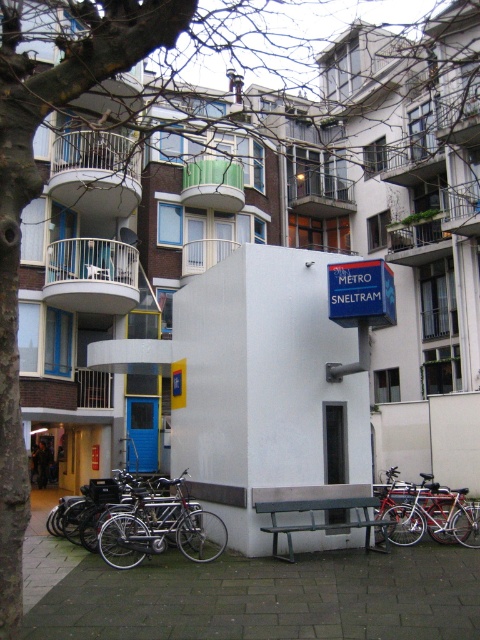
Between silver metallic bicycle at lower center and shiny metallic bicycle at lower right, which one appears on the left side from the viewer's perspective?

silver metallic bicycle at lower center is more to the left.

Who is more forward, (146, 532) or (453, 490)?

Positioned in front is point (146, 532).

In order to click on silver metallic bicycle at lower center in this screenshot , I will do pyautogui.click(x=158, y=528).